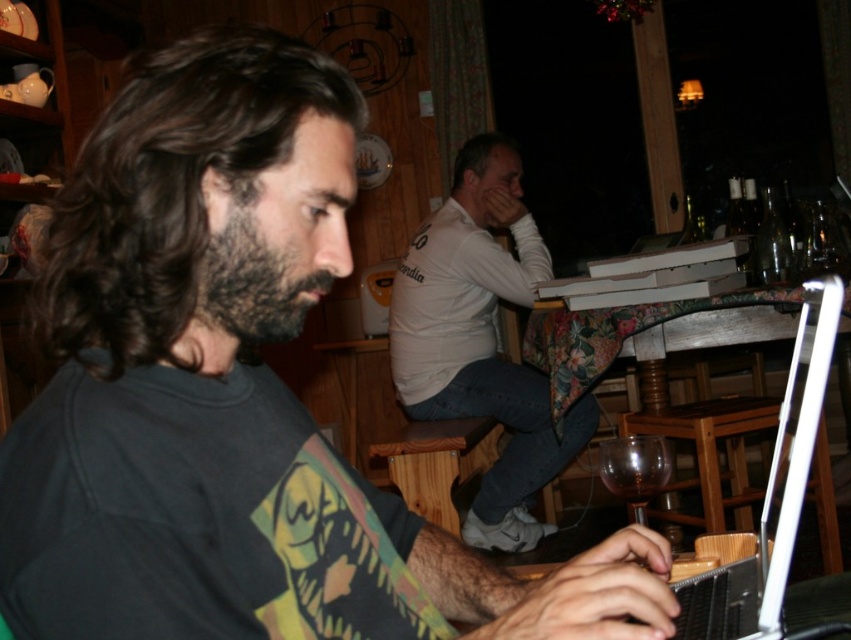
You are a customer in the cafe and want to place an order. You see the white plastic laptop at lower right and the dark brown fuzzy beard at left. Which object is closer to the edge of the table?

The white plastic laptop at lower right is closer to the edge of the table because it is located below the dark brown fuzzy beard at left, which is positioned further inward.

You are taking a photo of the scene and want to focus on both the man typing on the laptop and the person at the floral table. Which of the two points, point (380, 445) or point (598, 449), is closer to the camera?

Point (380, 445) is closer to the camera than point (598, 449).

You are trying to place a new rectangular plant pot that is 15 cm wide on the table. The white plastic laptop at lower right and wooden stool at lower center are already on the table. Can the plant pot fit on the table without overlapping either object?

The white plastic laptop at lower right has a lesser width compared to wooden stool at lower center. Since the plant pot is 15 cm wide, it depends on the available space between or around these objects. However, without specific spacing details between them, we cannot confirm if there is enough room. Please check the arrangement of the objects on the table.